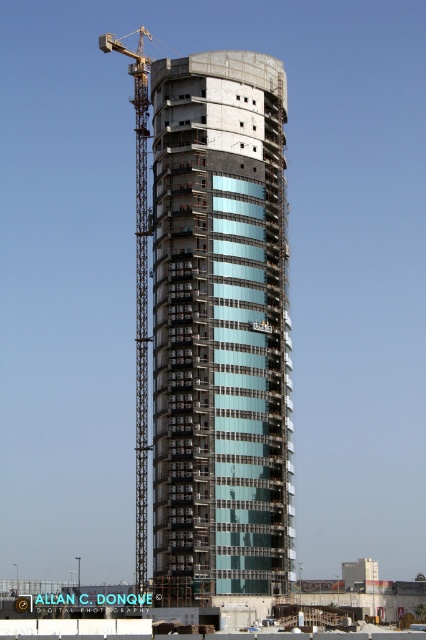
You are a construction worker who needs to move a heavy beam from the yellow metal crane at left to the clear glass building at center. The beam is 12 meters long. Can you safely transport it horizontally between the two without any part of the beam touching the ground or other structures?

The distance between the clear glass building at center and the yellow metal crane at left is 13.59 meters. Since the beam is only 12 meters long, it can be safely transported horizontally between them as the beam length is shorter than the distance, allowing enough space to avoid contact with the ground or other structures.

You are a construction worker standing on the ground floor of the transparent glass building at center. You need to move a heavy beam to the right side of the building. Can you use the yellow metal crane at left to lift and move the beam to the desired location?

The yellow metal crane at left is positioned on the left side of transparent glass building at center. Since the crane is on the left, it can swing its arm towards the right side of the building to move the beam there.